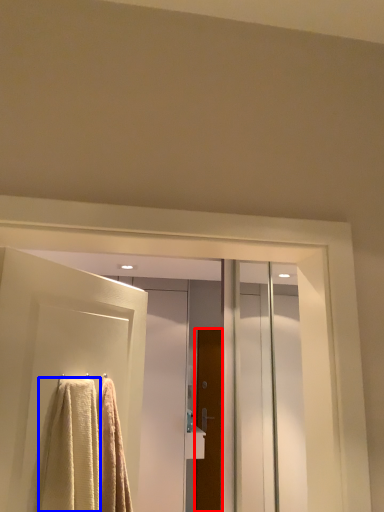
Question: Which object appears closest to the camera in this image, door (highlighted by a red box) or towel (highlighted by a blue box)?

Choices:
 (A) door
 (B) towel

Answer: (B)